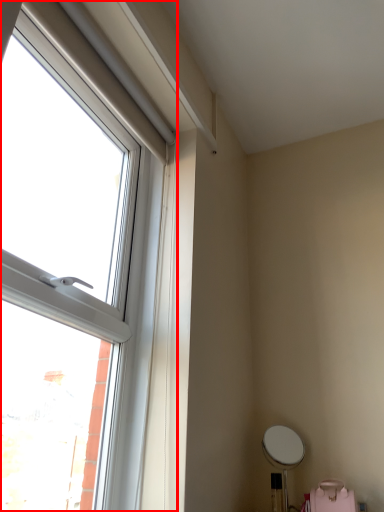
Question: From the image, what is the correct spatial relationship of window (annotated by the red box) in relation to swivel chair?

Choices:
 (A) left
 (B) right

Answer: (A)